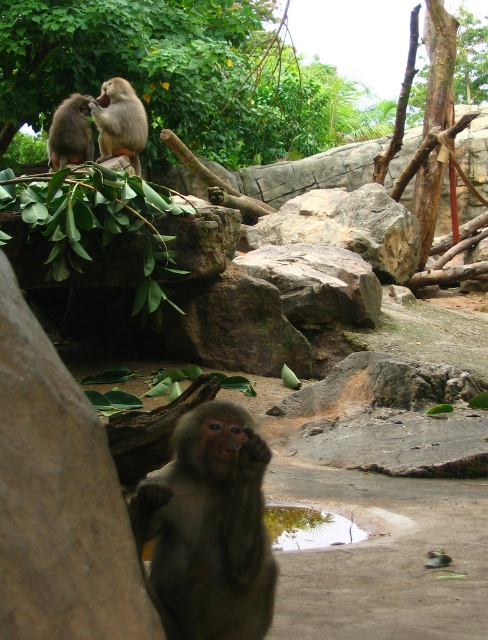
Question: Which point appears closest to the camera in this image?

Choices:
 (A) (286, 545)
 (B) (190, 557)
 (C) (87, 45)
 (D) (57, 113)

Answer: (B)

Question: Which point is farther to the camera?

Choices:
 (A) (101, 136)
 (B) (222, 582)
 (C) (67, 51)

Answer: (C)

Question: Does rocky gray rock at center have a larger size compared to gray furry monkey at upper left?

Choices:
 (A) no
 (B) yes

Answer: (B)

Question: Is smooth gray monkey at center to the left of rocky gray rock at center from the viewer's perspective?

Choices:
 (A) yes
 (B) no

Answer: (A)

Question: Where is green leafy tree at upper left located in relation to gray furry monkey at upper left in the image?

Choices:
 (A) right
 (B) left

Answer: (A)

Question: Which of these objects is positioned farthest from the light brown fur monkey at upper left?

Choices:
 (A) transparent glass puddle at lower center
 (B) rocky gray rock at center
 (C) green leafy tree at upper left

Answer: (A)